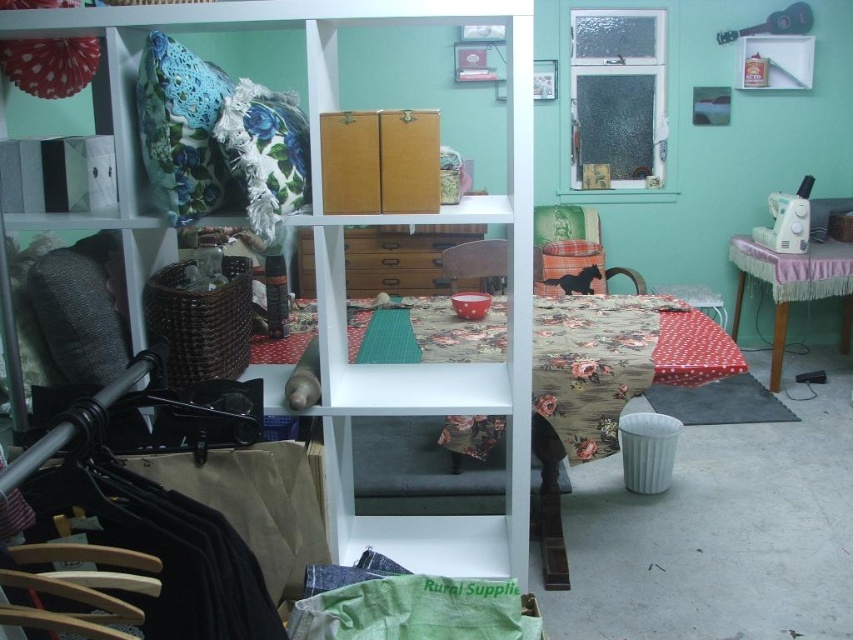
Question: Is wooden shelf at center positioned behind pink lace-covered sewing machine at right?

Choices:
 (A) no
 (B) yes

Answer: (A)

Question: Among these objects, which one is nearest to the camera?

Choices:
 (A) velvet green chair at center
 (B) wooden drawer at center
 (C) pink lace-covered sewing machine at right

Answer: (A)

Question: Which point is closer to the camera?

Choices:
 (A) (424, 236)
 (B) (573, 241)
 (C) (473, 548)
 (D) (842, 269)

Answer: (C)

Question: Is wooden shelf at center positioned in front of velvet green chair at center?

Choices:
 (A) yes
 (B) no

Answer: (A)

Question: Considering the real-world distances, which object is farthest from the wooden drawer at center?

Choices:
 (A) wooden chair at center
 (B) pink lace-covered sewing machine at right

Answer: (B)

Question: Is wooden shelf at center behind wooden chair at center?

Choices:
 (A) yes
 (B) no

Answer: (B)